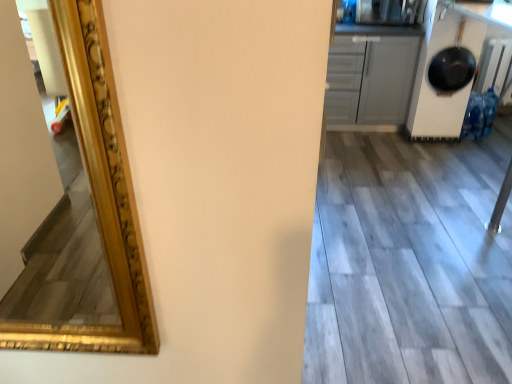
Question: Is wooden floor at lower right aimed at white matte cabinet at upper right?

Choices:
 (A) no
 (B) yes

Answer: (A)

Question: Is wooden floor at lower right smaller than white matte cabinet at upper right?

Choices:
 (A) no
 (B) yes

Answer: (B)

Question: Would you say wooden floor at lower right contains white matte cabinet at upper right?

Choices:
 (A) no
 (B) yes

Answer: (A)

Question: Considering the relative sizes of wooden floor at lower right and white matte cabinet at upper right in the image provided, is wooden floor at lower right bigger than white matte cabinet at upper right?

Choices:
 (A) yes
 (B) no

Answer: (B)

Question: Can we say wooden floor at lower right lies outside white matte cabinet at upper right?

Choices:
 (A) yes
 (B) no

Answer: (A)

Question: Is the surface of wooden floor at lower right in direct contact with white matte cabinet at upper right?

Choices:
 (A) no
 (B) yes

Answer: (A)

Question: Considering the relative positions of white matte cabinet at upper right and wooden floor at lower right in the image provided, is white matte cabinet at upper right to the left of wooden floor at lower right from the viewer's perspective?

Choices:
 (A) no
 (B) yes

Answer: (B)

Question: From a real-world perspective, is white matte cabinet at upper right physically below wooden floor at lower right?

Choices:
 (A) no
 (B) yes

Answer: (A)

Question: Is white matte cabinet at upper right wider than wooden floor at lower right?

Choices:
 (A) yes
 (B) no

Answer: (B)

Question: Can you confirm if white matte cabinet at upper right is thinner than wooden floor at lower right?

Choices:
 (A) yes
 (B) no

Answer: (A)

Question: From the image's perspective, is white matte cabinet at upper right located above wooden floor at lower right?

Choices:
 (A) no
 (B) yes

Answer: (B)

Question: Considering the relative sizes of white matte cabinet at upper right and wooden floor at lower right in the image provided, is white matte cabinet at upper right taller than wooden floor at lower right?

Choices:
 (A) yes
 (B) no

Answer: (A)

Question: Relative to white matte cabinet at upper right, is wooden floor at lower right in front or behind?

Choices:
 (A) front
 (B) behind

Answer: (A)